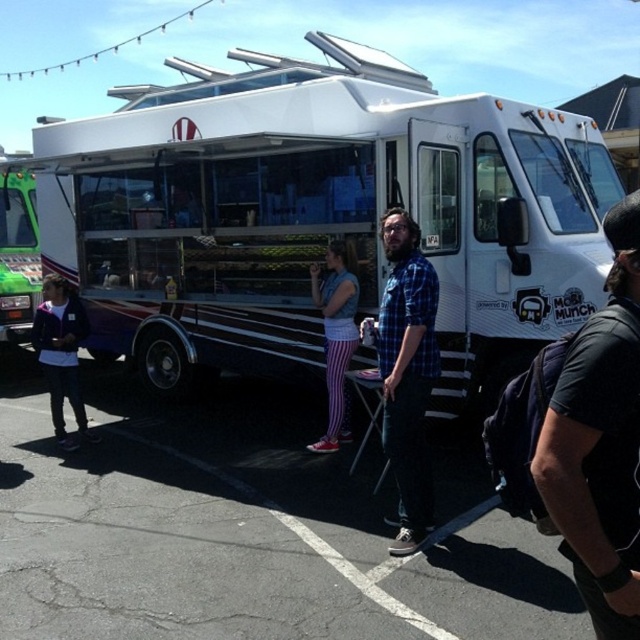
Is white glossy food truck at center shorter than black fabric backpack at lower right?

No.

In the scene shown: Which is above, white glossy food truck at center or black fabric backpack at lower right?

white glossy food truck at center

Is point (579, 216) less distant than point (627, 467)?

That is False.

Locate an element on the screen. white glossy food truck at center is located at coordinates (320, 216).

Is blue plaid shirt at center above matte purple jacket at left?

Correct, blue plaid shirt at center is located above matte purple jacket at left.

Find the location of `blue plaid shirt at center`. blue plaid shirt at center is located at coordinates (406, 372).

What do you see at coordinates (600, 442) in the screenshot? Image resolution: width=640 pixels, height=640 pixels. I see `black fabric backpack at lower right` at bounding box center [600, 442].

Is black fabric backpack at lower right behind denim vest at center?

No, it is in front of denim vest at center.

Find the location of a particular element. black fabric backpack at lower right is located at coordinates (600, 442).

You are a GUI agent. You are given a task and a screenshot of the screen. Output one action in this format:
    pyautogui.click(x=<x>, y=<y>)
    Task: Click on the black fabric backpack at lower right
    Image resolution: width=640 pixels, height=640 pixels.
    Given the screenshot: What is the action you would take?
    pyautogui.click(x=600, y=442)